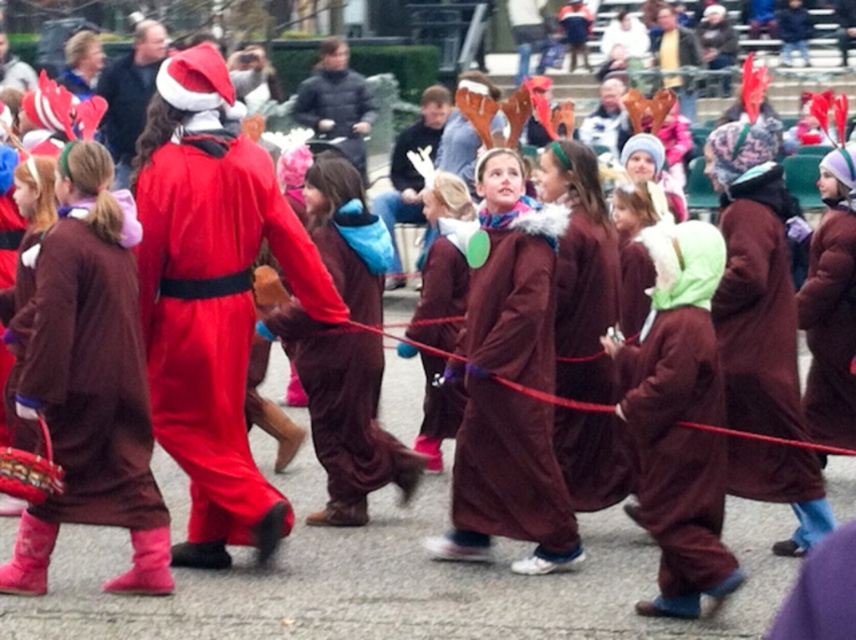
Question: Can you confirm if velvet santa claus at center is bigger than brown velvet robe at center?

Choices:
 (A) yes
 (B) no

Answer: (A)

Question: Which of these objects is positioned farthest from the velvet santa claus at center?

Choices:
 (A) brown fuzzy coat at center
 (B) brown velvet robe at center
 (C) brown fuzzy robe at center

Answer: (B)

Question: Is velvet santa claus at center thinner than brown velvet robe at center?

Choices:
 (A) yes
 (B) no

Answer: (B)

Question: Which point appears farthest from the camera in this image?

Choices:
 (A) (224, 170)
 (B) (369, 300)
 (C) (518, 321)
 (D) (56, 497)

Answer: (B)

Question: Which of the following is the farthest from the observer?

Choices:
 (A) (199, 48)
 (B) (372, 472)
 (C) (456, 547)
 (D) (67, 312)

Answer: (A)

Question: Is velvet santa claus at center bigger than brown fuzzy robe at center?

Choices:
 (A) yes
 (B) no

Answer: (A)